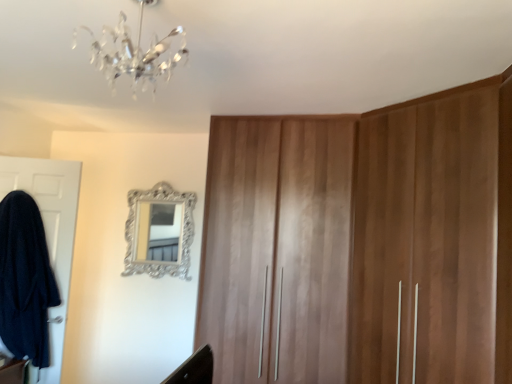
Question: Is silver ornate mirror at upper center turned away from wooden wardrobe at center?

Choices:
 (A) yes
 (B) no

Answer: (B)

Question: Does silver ornate mirror at upper center turn towards wooden wardrobe at center?

Choices:
 (A) yes
 (B) no

Answer: (B)

Question: Considering the relative positions of silver ornate mirror at upper center and wooden wardrobe at center in the image provided, is silver ornate mirror at upper center behind wooden wardrobe at center?

Choices:
 (A) no
 (B) yes

Answer: (B)

Question: Is silver ornate mirror at upper center shorter than wooden wardrobe at center?

Choices:
 (A) no
 (B) yes

Answer: (B)

Question: From a real-world perspective, is silver ornate mirror at upper center physically below wooden wardrobe at center?

Choices:
 (A) yes
 (B) no

Answer: (B)

Question: From the image's perspective, relative to white matte door at left, is silver ornate mirror at upper center above or below?

Choices:
 (A) below
 (B) above

Answer: (B)

Question: Visually, is silver ornate mirror at upper center positioned to the left or to the right of white matte door at left?

Choices:
 (A) left
 (B) right

Answer: (B)

Question: From their relative heights in the image, would you say silver ornate mirror at upper center is taller or shorter than white matte door at left?

Choices:
 (A) tall
 (B) short

Answer: (B)

Question: Is silver ornate mirror at upper center situated inside white matte door at left or outside?

Choices:
 (A) inside
 (B) outside

Answer: (B)

Question: Relative to wooden wardrobe at center, is crystal glass chandelier at upper center in front or behind?

Choices:
 (A) front
 (B) behind

Answer: (A)

Question: Looking at their shapes, would you say crystal glass chandelier at upper center is wider or thinner than wooden wardrobe at center?

Choices:
 (A) thin
 (B) wide

Answer: (A)

Question: Would you say crystal glass chandelier at upper center is to the left or to the right of wooden wardrobe at center in the picture?

Choices:
 (A) right
 (B) left

Answer: (B)

Question: In terms of height, does crystal glass chandelier at upper center look taller or shorter compared to wooden wardrobe at center?

Choices:
 (A) tall
 (B) short

Answer: (B)

Question: In terms of height, does crystal glass chandelier at upper center look taller or shorter compared to silver ornate mirror at upper center?

Choices:
 (A) tall
 (B) short

Answer: (B)

Question: From a real-world perspective, is crystal glass chandelier at upper center above or below silver ornate mirror at upper center?

Choices:
 (A) above
 (B) below

Answer: (A)